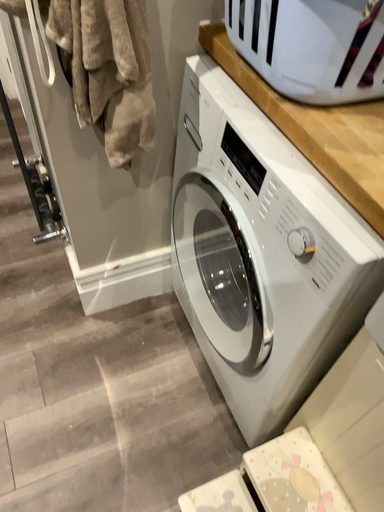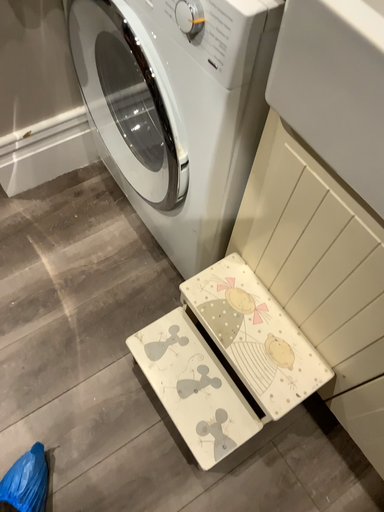
Question: How did the camera likely rotate when shooting the video?

Choices:
 (A) rotated downward
 (B) rotated upward

Answer: (A)